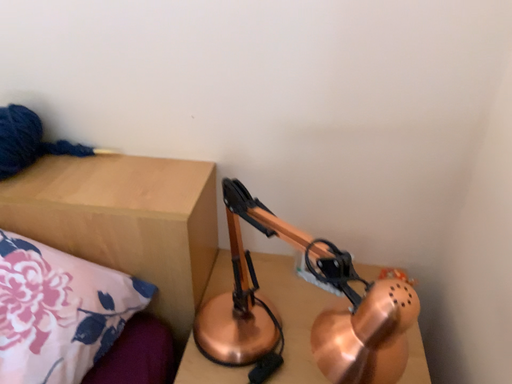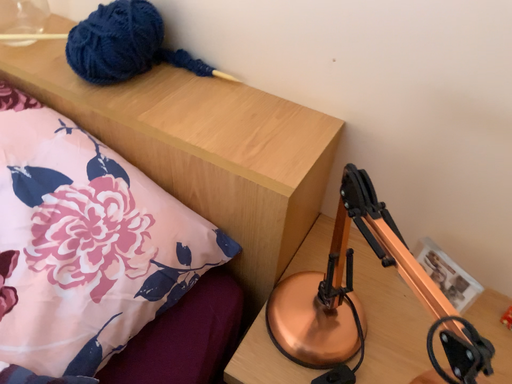
Question: Which way did the camera rotate in the video?

Choices:
 (A) rotated upward
 (B) rotated downward

Answer: (B)